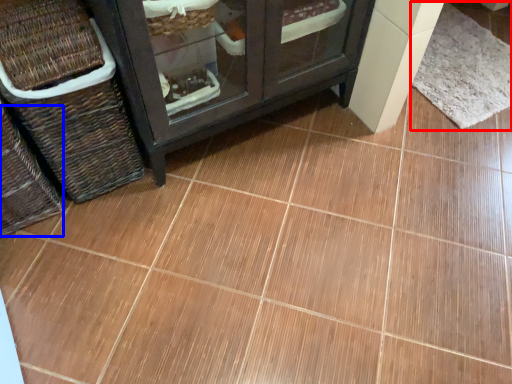
Question: Which object appears closest to the camera in this image, mat (highlighted by a red box) or basket (highlighted by a blue box)?

Choices:
 (A) mat
 (B) basket

Answer: (B)